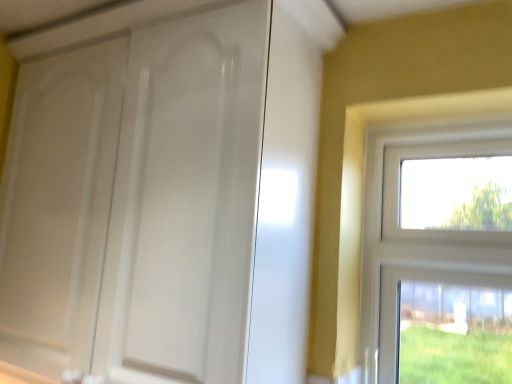
This screenshot has height=384, width=512. Describe the element at coordinates (161, 202) in the screenshot. I see `matte white cupboard at left` at that location.

At what (x,y) coordinates should I click in order to perform the action: click on matte white cupboard at left. Please return your answer as a coordinate pair (x, y). Looking at the image, I should click on (161, 202).

In order to face matte white cupboard at left, should I rotate leftwards or rightwards?

A 14.339 degree turn to the left will do.

Identify the location of matte white cupboard at left. Image resolution: width=512 pixels, height=384 pixels. (161, 202).